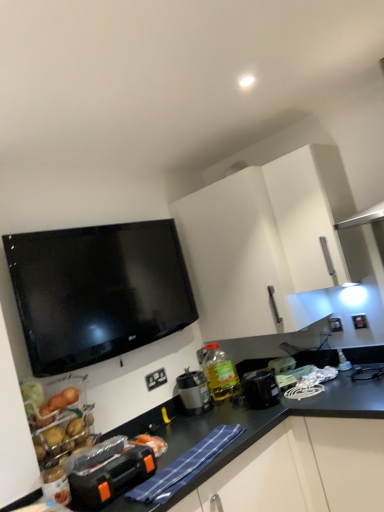
The width and height of the screenshot is (384, 512). I want to click on vacant space situated above black plastic toolbox at lower left, the fourth appliance positioned from the back (from a real-world perspective), so click(112, 457).